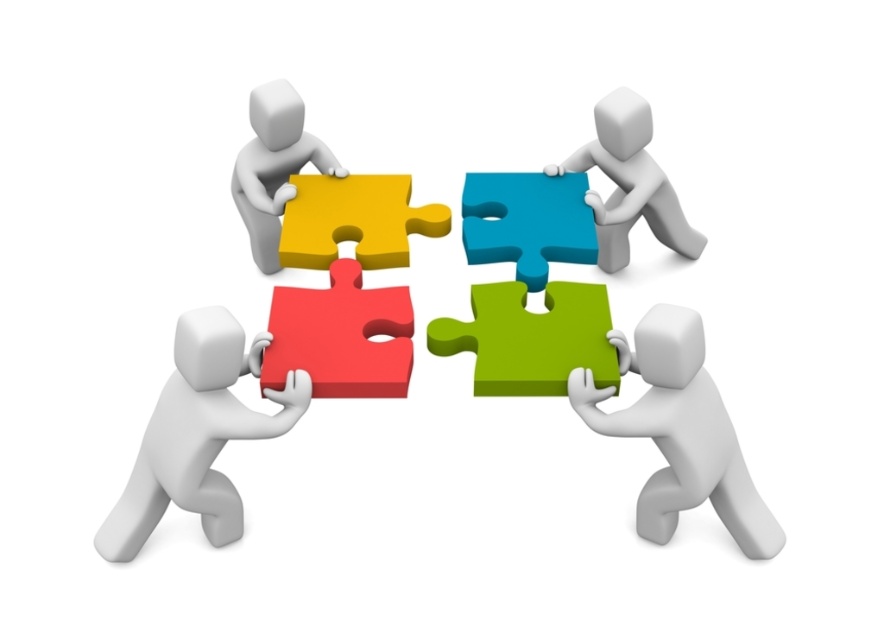
Does matte white figure at lower left have a greater height compared to green matte puzzle piece at lower right?

Indeed, matte white figure at lower left has a greater height compared to green matte puzzle piece at lower right.

Does matte white figure at lower left have a lesser width compared to green matte puzzle piece at lower right?

No, matte white figure at lower left is not thinner than green matte puzzle piece at lower right.

Image resolution: width=884 pixels, height=640 pixels. I want to click on matte white figure at lower left, so click(197, 435).

Does white matte puzzle piece at upper center appear over matte yellow puzzle piece at upper left?

Yes.

In the scene shown: Is white matte puzzle piece at upper center further to the viewer compared to matte yellow puzzle piece at upper left?

Yes, white matte puzzle piece at upper center is behind matte yellow puzzle piece at upper left.

At what (x,y) coordinates should I click in order to perform the action: click on white matte puzzle piece at upper center. Please return your answer as a coordinate pair (x, y). Image resolution: width=884 pixels, height=640 pixels. Looking at the image, I should click on (629, 180).

Is matte white figure at lower left to the left of white matte puzzle piece at upper center from the viewer's perspective?

Yes, matte white figure at lower left is to the left of white matte puzzle piece at upper center.

Is matte white figure at lower left shorter than white matte puzzle piece at upper center?

In fact, matte white figure at lower left may be taller than white matte puzzle piece at upper center.

What do you see at coordinates (197, 435) in the screenshot?
I see `matte white figure at lower left` at bounding box center [197, 435].

The width and height of the screenshot is (884, 640). In order to click on matte white figure at lower left in this screenshot , I will do `click(197, 435)`.